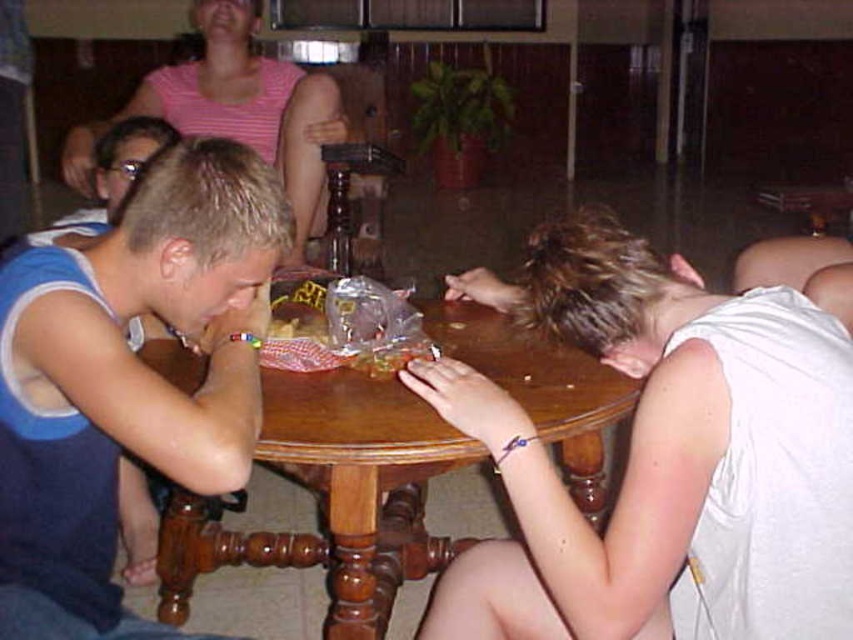
Which is in front, point (535, 529) or point (149, 438)?

Point (535, 529) is in front.

Can you confirm if white matte shirt at lower right is shorter than blue jersey at left?

Indeed, white matte shirt at lower right has a lesser height compared to blue jersey at left.

Does point (712, 449) come in front of point (35, 353)?

That is True.

Locate an element on the screen. This screenshot has height=640, width=853. white matte shirt at lower right is located at coordinates click(x=660, y=458).

Based on the photo, does white matte shirt at lower right have a smaller size compared to pink striped shirt at upper center?

Indeed, white matte shirt at lower right has a smaller size compared to pink striped shirt at upper center.

Does white matte shirt at lower right have a larger size compared to pink striped shirt at upper center?

No, white matte shirt at lower right is not bigger than pink striped shirt at upper center.

Find the location of `white matte shirt at lower right`. white matte shirt at lower right is located at coordinates (660, 458).

The image size is (853, 640). In order to click on white matte shirt at lower right in this screenshot , I will do `click(660, 458)`.

How far apart are blue jersey at left and wooden at center?

blue jersey at left and wooden at center are 14.24 inches apart from each other.

Measure the distance between blue jersey at left and camera.

37.11 inches

Where is `blue jersey at left`? blue jersey at left is located at coordinates (126, 380).